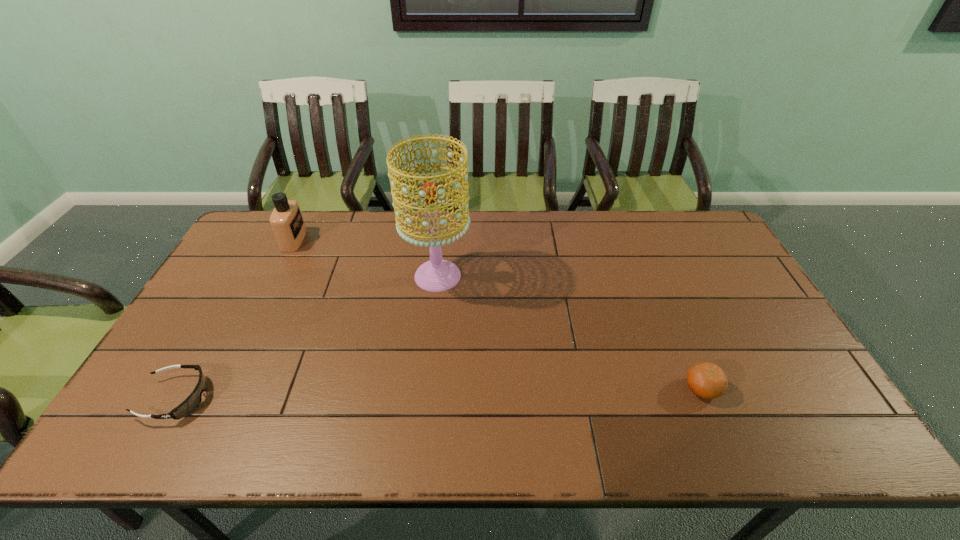
Locate an element on the screen. The width and height of the screenshot is (960, 540). the second farthest object is located at coordinates (437, 275).

I want to click on the tallest object, so [437, 275].

Identify the location of perfume. Image resolution: width=960 pixels, height=540 pixels. (286, 220).

Where is `the second tallest object`? the second tallest object is located at coordinates (286, 220).

Where is `the third tallest object`? The width and height of the screenshot is (960, 540). the third tallest object is located at coordinates (707, 380).

Where is `clementine`? clementine is located at coordinates (707, 380).

Where is `the shortest object`? the shortest object is located at coordinates (194, 399).

Where is `vacant space located on the front of the lampshade`? This screenshot has width=960, height=540. vacant space located on the front of the lampshade is located at coordinates (428, 368).

Image resolution: width=960 pixels, height=540 pixels. What are the coordinates of `vacant space located 0.380m on the front label of the farthest object` in the screenshot? It's located at (413, 240).

I want to click on vacant area located on the front of the third tallest object, so click(718, 428).